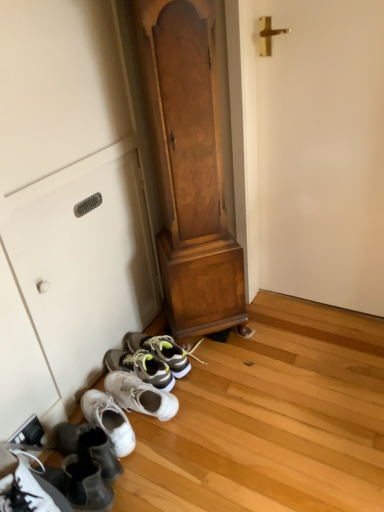
What are the coordinates of `vacant area that lies to the right of wooden dresser at center` in the screenshot? It's located at (273, 336).